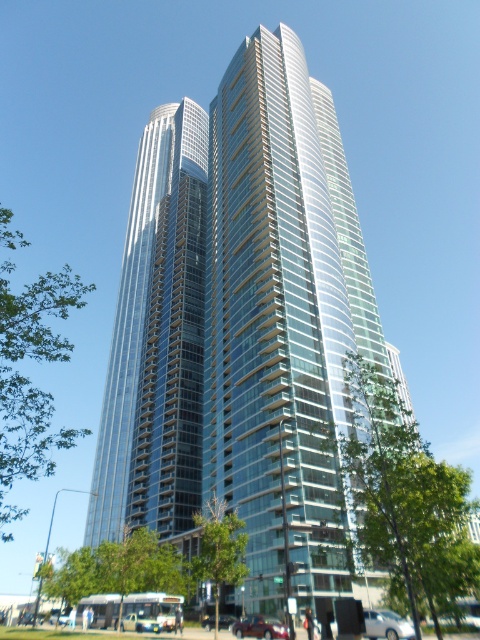
You are standing at the base of the building and want to reach the green leafy tree at left. The path is clear, but you have a 70 feet long rope. Is the rope long enough to reach the tree from where you are standing?

The green leafy tree at left and viewer are 67.74 feet apart from each other. Since the rope is 70 feet long, which is longer than the distance, the rope is long enough to reach the tree from where you are standing.

Consider the image. You are standing in front of the building and notice the green leafy tree at left and the white glossy sedan at lower right. Which object is positioned more to the left side of the scene?

The green leafy tree at left is positioned more to the left side of the scene compared to the white glossy sedan at lower right.